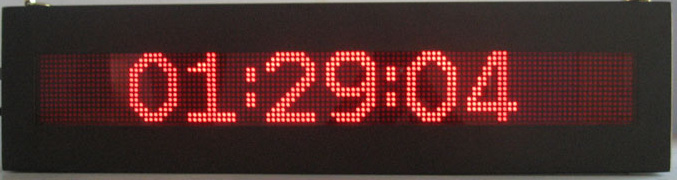
I want to click on digital screen, so click(554, 94).